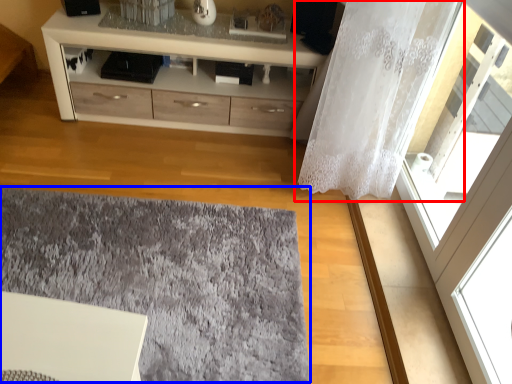
Question: Which of the following is the closest to the observer, curtain (highlighted by a red box) or mat (highlighted by a blue box)?

Choices:
 (A) curtain
 (B) mat

Answer: (B)